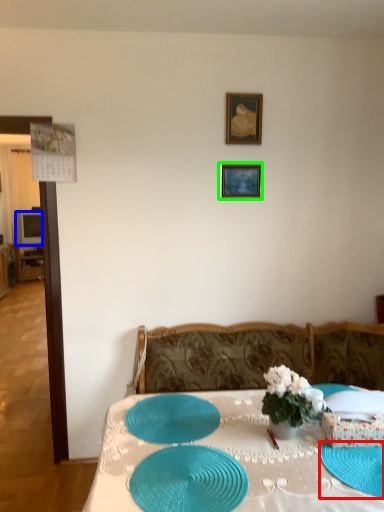
Question: Which object is positioned closest to glass plate (highlighted by a red box)? Select from television (highlighted by a blue box) and picture frame (highlighted by a green box).

Choices:
 (A) television
 (B) picture frame

Answer: (B)